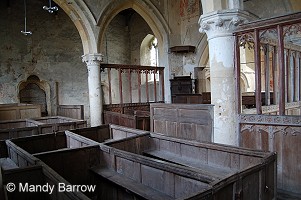
This screenshot has height=200, width=301. Identify the location of back window. (153, 49).